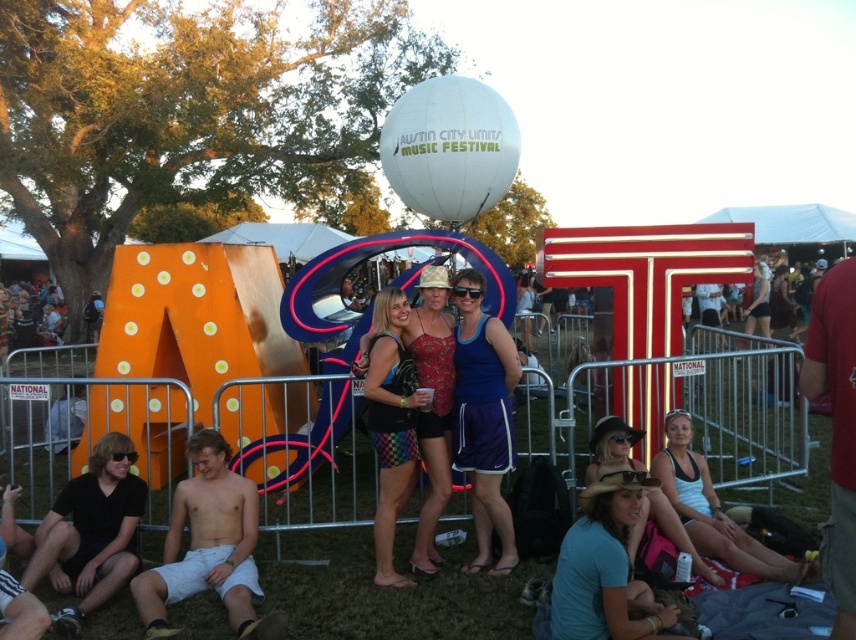
Question: Does blue cotton shirt at lower right lie in front of rainbow checkered shorts at center?

Choices:
 (A) yes
 (B) no

Answer: (A)

Question: Which point is farther from the camera taking this photo?

Choices:
 (A) (615, 433)
 (B) (490, 360)
 (C) (684, 520)

Answer: (A)

Question: Can you confirm if blue fabric skirt at center is thinner than rainbow checkered shorts at center?

Choices:
 (A) no
 (B) yes

Answer: (B)

Question: In this image, where is white cotton shorts at lower left located relative to matte straw hat at lower right?

Choices:
 (A) below
 (B) above

Answer: (A)

Question: Among these points, which one is farthest from the camera?

Choices:
 (A) 709,544
 (B) 645,508
 (C) 400,397

Answer: (C)

Question: Which is nearer to the blue cotton shirt at lower right?

Choices:
 (A) white cotton shorts at lower left
 (B) white tank top at lower right

Answer: (B)